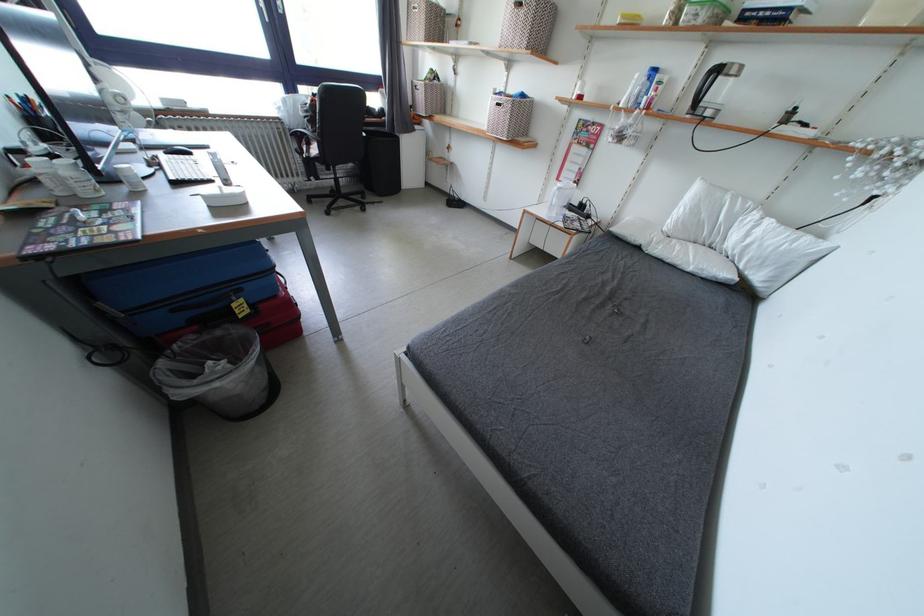
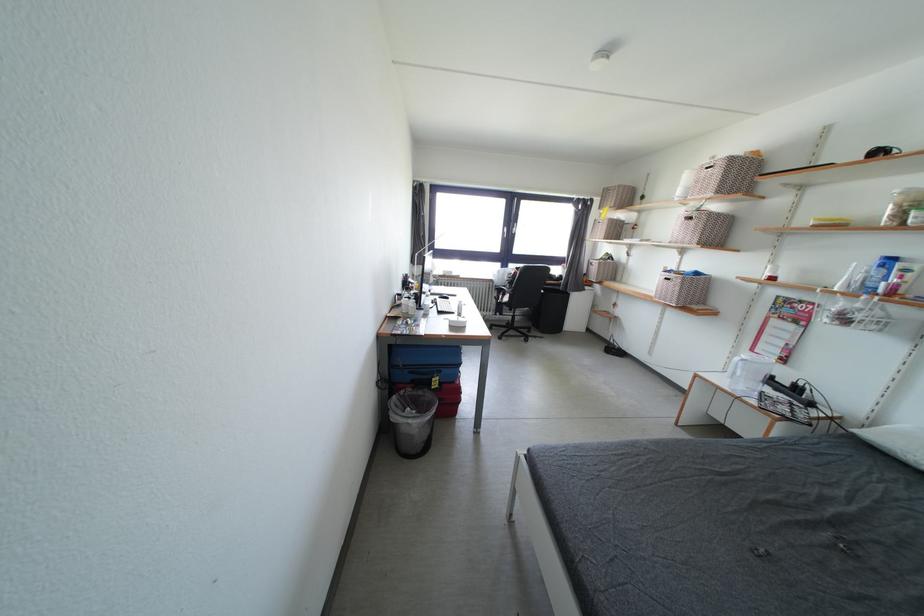
The point at (x=196, y=159) is marked in the first image. Where is the corresponding point in the second image?

(455, 302)